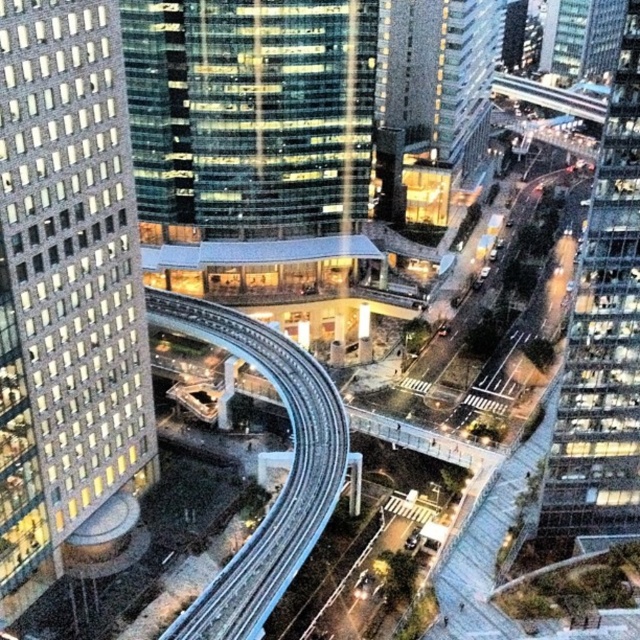
Which is more to the right, glassy reflective skyscraper at center or transparent glass skyscraper at right?

From the viewer's perspective, transparent glass skyscraper at right appears more on the right side.

Is point (156, 54) more distant than point (630, 88)?

That is True.

Locate an element on the screen. glassy reflective skyscraper at center is located at coordinates (252, 113).

Which is behind, point (221, 81) or point (307, 540)?

Point (221, 81)

Measure the distance between glassy reflective skyscraper at center and metallic silver train track at center.

A distance of 45.98 meters exists between glassy reflective skyscraper at center and metallic silver train track at center.

Which is in front, point (346, 65) or point (250, 317)?

Point (250, 317) is more forward.

At what (x,y) coordinates should I click in order to perform the action: click on glassy reflective skyscraper at center. Please return your answer as a coordinate pair (x, y). Image resolution: width=640 pixels, height=640 pixels. Looking at the image, I should click on (252, 113).

Can you confirm if transparent glass skyscraper at right is positioned to the left of metallic silver train track at center?

No, transparent glass skyscraper at right is not to the left of metallic silver train track at center.

Who is higher up, transparent glass skyscraper at right or metallic silver train track at center?

Positioned higher is transparent glass skyscraper at right.

Measure the distance between point [596,328] and camera.

The distance of point [596,328] from camera is 98.14 meters.

At what (x,y) coordinates should I click in order to perform the action: click on transparent glass skyscraper at right. Please return your answer as a coordinate pair (x, y). Looking at the image, I should click on (602, 339).